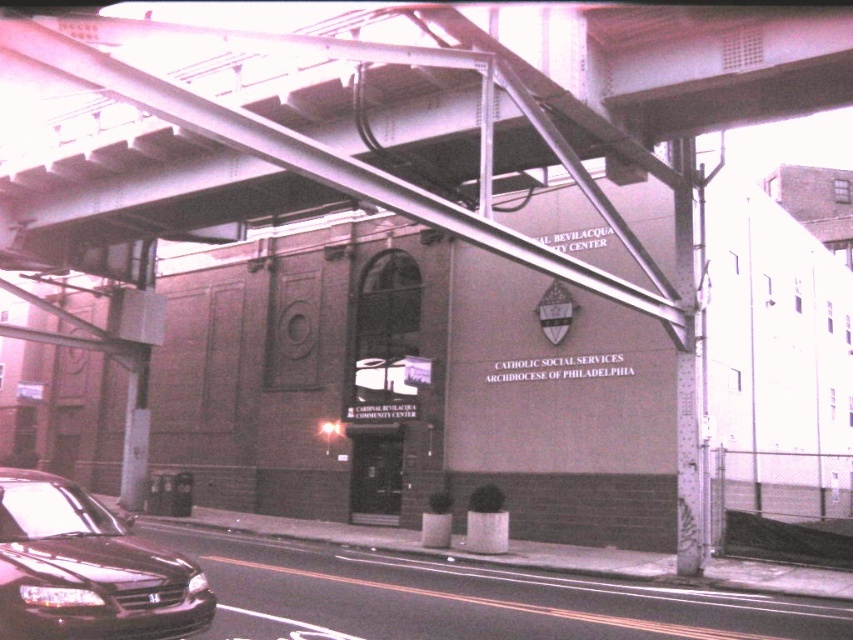
You are a delivery person needing to park your van near the Cardinal Bevilacqua Community Center. The van requires a parking space that is at least 25 feet long. Based on the image, can you determine if there is enough space between the metal at upper center and the shiny black sedan at lower left to accommodate your van?

The distance between the metal at upper center and the shiny black sedan at lower left is 26.27 feet, which is sufficient to accommodate your van since it meets the required 25 feet length.

You are a delivery driver who needs to park your vehicle near the Cardinal Bevilacqua Community Center. There is a metal object at upper center. Is the metal at upper center blocking the parking spot for the black car on the left side of the frame?

The metal at upper center is located at point (689, 72), which is above and to the left of the black car on the left side of the frame. Therefore, the metal at upper center is not blocking the parking spot for the black car on the left side of the frame.